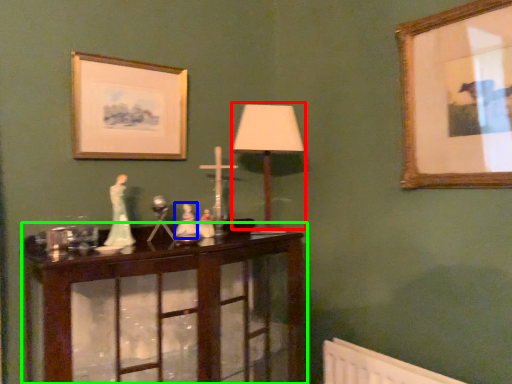
Question: Which object is positioned farthest from table lamp (highlighted by a red box)? Select from toy (highlighted by a blue box) and table (highlighted by a green box).

Choices:
 (A) toy
 (B) table

Answer: (B)